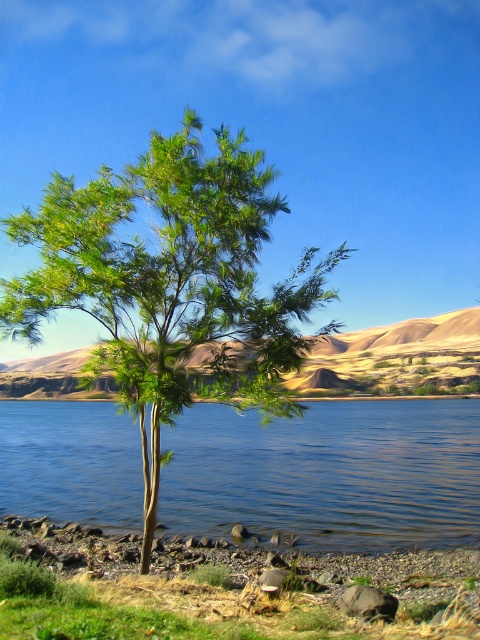
You are a bird flying over the landscape. You want to land on the green leafy tree at center. Which direction should you fly to avoid the blue liquid water at center?

The green leafy tree at center is in front of the blue liquid water at center, so you should fly towards the tree to land safely without encountering the water.

You are standing at the edge of the lake and want to walk to the tree. Which direction should you move to reach the green leafy tree at center from the blue liquid water at center?

The green leafy tree at center is to the left of the blue liquid water at center, so you should move to your left to reach the tree.

You are a bird flying over the landscape. You want to land on the highest point you can see. Which object would you choose between the green leafy tree at center and the blue liquid water at center?

The green leafy tree at center is much taller than the blue liquid water at center, so the bird should land on the green leafy tree at center.